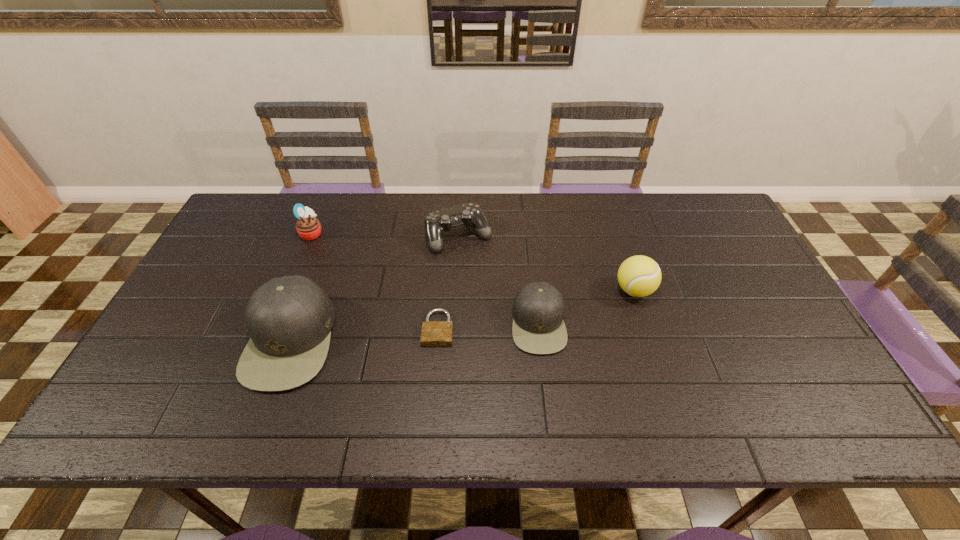
The image size is (960, 540). I want to click on object that is positioned at the near edge, so click(x=289, y=319).

In the image, there is a desktop. Where is `vacant space at the far edge`? The width and height of the screenshot is (960, 540). vacant space at the far edge is located at coordinates (555, 214).

Find the location of a particular element. This screenshot has width=960, height=540. free space at the near edge of the desktop is located at coordinates (229, 373).

Image resolution: width=960 pixels, height=540 pixels. In the image, there is a desktop. In order to click on vacant space at the left edge in this screenshot , I will do pos(210,258).

You are a GUI agent. You are given a task and a screenshot of the screen. Output one action in this format:
    pyautogui.click(x=<x>, y=<y>)
    Task: Click on the vacant space at the right edge of the desktop
    
    Given the screenshot: What is the action you would take?
    pyautogui.click(x=781, y=329)

Where is `free space at the far left corner of the desktop`? free space at the far left corner of the desktop is located at coordinates (257, 194).

You are a GUI agent. You are given a task and a screenshot of the screen. Output one action in this format:
    pyautogui.click(x=<x>, y=<y>)
    Task: Click on the free space at the near left corner
    The height and width of the screenshot is (540, 960).
    Given the screenshot: What is the action you would take?
    pyautogui.click(x=174, y=382)

This screenshot has height=540, width=960. Find the location of `free space between the taller cap and the control`. free space between the taller cap and the control is located at coordinates (374, 288).

The height and width of the screenshot is (540, 960). What are the coordinates of `free space between the tallest object and the control` in the screenshot? It's located at (374, 288).

I want to click on empty space that is in between the taller cap and the shorter cap, so click(415, 332).